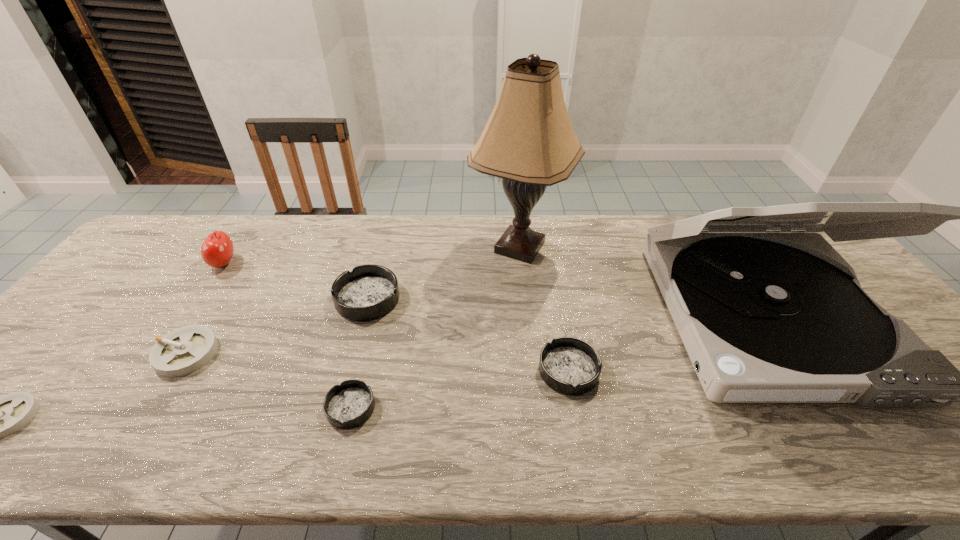
The width and height of the screenshot is (960, 540). I want to click on vacant area that lies between the tallest ashtray and the rightmost object, so pos(567,307).

The image size is (960, 540). In order to click on free spot between the bigger gray ashtray and the seventh shortest object in this screenshot , I will do `click(477, 335)`.

The width and height of the screenshot is (960, 540). Identify the location of free space between the third tallest object and the rightmost dark ashtray. (396, 316).

Where is `vacant space that's between the farther gray ashtray and the fifth shortest object`? The image size is (960, 540). vacant space that's between the farther gray ashtray and the fifth shortest object is located at coordinates (277, 326).

I want to click on object that stands as the sixth closest to the smallest dark ashtray, so 0,417.

Identify which object is the seventh nearest to the lamp. Please provide its 2D coordinates. Your answer should be formatted as a tuple, i.e. [(x, y)], where the tuple contains the x and y coordinates of a point satisfying the conditions above.

[(0, 417)]

Point out which ashtray is positioned as the second nearest to the beige lamp. Please provide its 2D coordinates. Your answer should be formatted as a tuple, i.e. [(x, y)], where the tuple contains the x and y coordinates of a point satisfying the conditions above.

[(571, 366)]

Locate an element on the screen. the fourth closest ashtray to the seventh shortest object is located at coordinates (185, 350).

You are a GUI agent. You are given a task and a screenshot of the screen. Output one action in this format:
    pyautogui.click(x=<x>, y=<y>)
    Task: Click on the second closest dark ashtray to the third tallest object
    
    Given the screenshot: What is the action you would take?
    pos(348,405)

Identify which dark ashtray is the second closest to the leftmost ashtray. Please provide its 2D coordinates. Your answer should be formatted as a tuple, i.e. [(x, y)], where the tuple contains the x and y coordinates of a point satisfying the conditions above.

[(348, 405)]